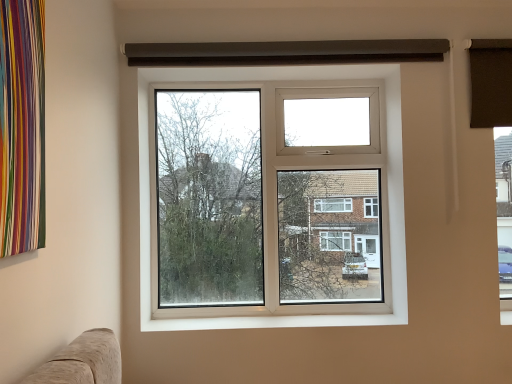
Question: From the image's perspective, does white smooth window sill at lower center appear lower than white plastic window at center?

Choices:
 (A) yes
 (B) no

Answer: (A)

Question: Is white smooth window sill at lower center not inside white plastic window at center?

Choices:
 (A) no
 (B) yes

Answer: (B)

Question: Does white smooth window sill at lower center come behind white plastic window at center?

Choices:
 (A) no
 (B) yes

Answer: (A)

Question: From a real-world perspective, is white smooth window sill at lower center physically above white plastic window at center?

Choices:
 (A) yes
 (B) no

Answer: (B)

Question: Is white smooth window sill at lower center facing towards white plastic window at center?

Choices:
 (A) no
 (B) yes

Answer: (A)

Question: Can you confirm if white smooth window sill at lower center is taller than white plastic window at center?

Choices:
 (A) yes
 (B) no

Answer: (B)

Question: From the image's perspective, is white plastic window at center below white smooth window sill at lower center?

Choices:
 (A) yes
 (B) no

Answer: (B)

Question: Is white plastic window at center wider than white smooth window sill at lower center?

Choices:
 (A) yes
 (B) no

Answer: (B)

Question: Are white plastic window at center and white smooth window sill at lower center located far from each other?

Choices:
 (A) no
 (B) yes

Answer: (A)

Question: Is white plastic window at center positioned in front of white smooth window sill at lower center?

Choices:
 (A) no
 (B) yes

Answer: (A)

Question: Would you say white plastic window at center is outside white smooth window sill at lower center?

Choices:
 (A) yes
 (B) no

Answer: (A)

Question: Can you confirm if white plastic window at center is positioned to the left of white smooth window sill at lower center?

Choices:
 (A) yes
 (B) no

Answer: (A)

Question: Based on their sizes in the image, would you say white plastic window at center is bigger or smaller than white smooth window sill at lower center?

Choices:
 (A) big
 (B) small

Answer: (A)